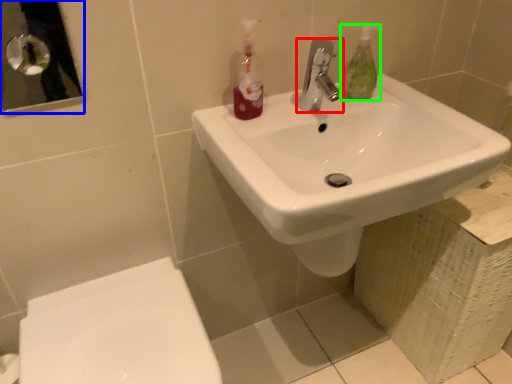
Question: Which is nearer to the tap (highlighted by a red box)? mirror (highlighted by a blue box) or mouthwash (highlighted by a green box).

Choices:
 (A) mirror
 (B) mouthwash

Answer: (B)